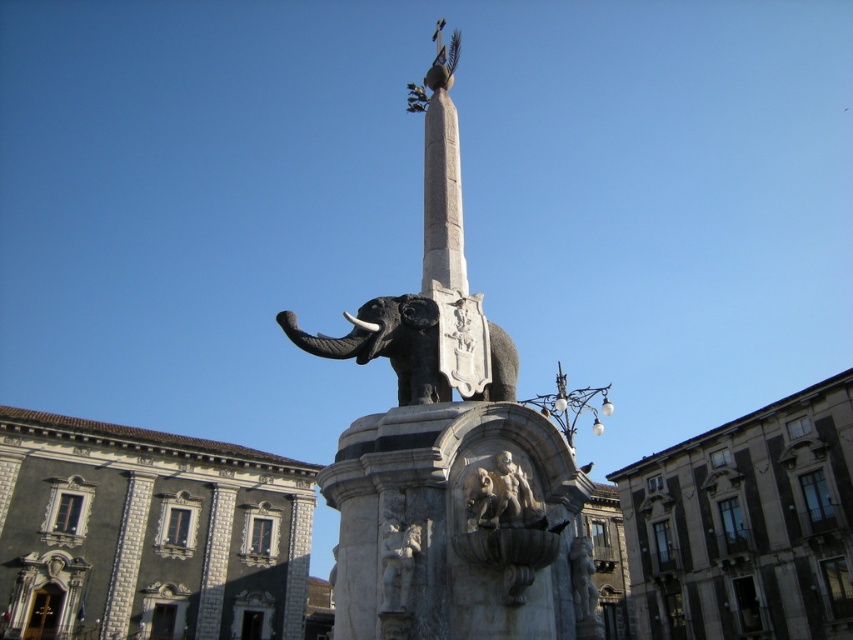
Measure the distance between polished stone elephant at center and camera.

19.38 meters

Is point (428, 502) closer to viewer compared to point (410, 582)?

No, it is not.

Who is more forward, (517,532) or (386,538)?

Point (517,532)

This screenshot has width=853, height=640. Identify the location of polished stone elephant at center. (450, 445).

Who is positioned more to the right, gray stone fountain at center or polished stone elephant at center?

From the viewer's perspective, polished stone elephant at center appears more on the right side.

Does gray stone fountain at center have a smaller size compared to polished stone elephant at center?

No.

Which is in front, point (776, 588) or point (473, 440)?

Point (473, 440)

Identify the location of gray stone fountain at center. This screenshot has height=640, width=853. (144, 532).

Based on the photo, who is lower down, polished stone elephant at center or polished bronze elephant at center?

polished bronze elephant at center is below.

Can you confirm if polished stone elephant at center is positioned to the left of polished bronze elephant at center?

Incorrect, polished stone elephant at center is not on the left side of polished bronze elephant at center.

Between point (444, 381) and point (432, 328), which one is positioned in front?

Positioned in front is point (444, 381).

The width and height of the screenshot is (853, 640). What are the coordinates of `polished stone elephant at center` in the screenshot? It's located at (450, 445).